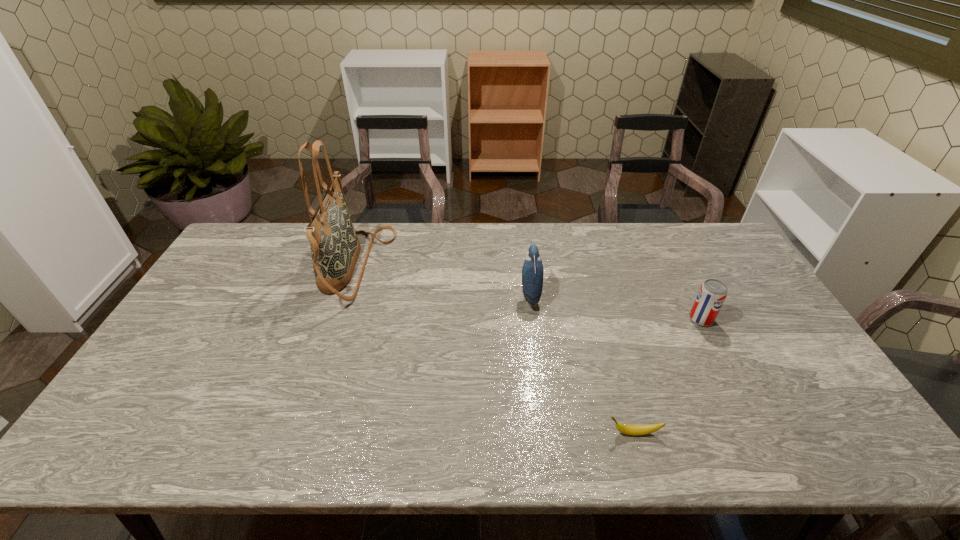
Find the location of a particular element. Image resolution: width=960 pixels, height=540 pixels. blank region between the soda and the bird is located at coordinates (615, 307).

Identify the location of the third closest object to the bird. (335, 248).

This screenshot has height=540, width=960. Find the location of `object identified as the closest to the leftmost object`. object identified as the closest to the leftmost object is located at coordinates (532, 270).

You are a GUI agent. You are given a task and a screenshot of the screen. Output one action in this format:
    pyautogui.click(x=<x>, y=<y>)
    Task: Click on the vacant point that satisfies the following two spatial constraints: 1. at the tip of the third shortest object's beak; 2. on the right side of the third tallest object
    The height and width of the screenshot is (540, 960).
    Given the screenshot: What is the action you would take?
    pyautogui.click(x=533, y=319)

This screenshot has width=960, height=540. Find the location of `vacant region that satisfies the following two spatial constraints: 1. on the back side of the second shortest object; 2. on the front-facing side of the tallest object`. vacant region that satisfies the following two spatial constraints: 1. on the back side of the second shortest object; 2. on the front-facing side of the tallest object is located at coordinates (674, 266).

Where is `free point that satisfies the following two spatial constraints: 1. at the tip of the bird's beak; 2. on the right side of the rightmost object`? free point that satisfies the following two spatial constraints: 1. at the tip of the bird's beak; 2. on the right side of the rightmost object is located at coordinates (533, 319).

Find the location of a particular element. This screenshot has width=960, height=540. free location that satisfies the following two spatial constraints: 1. at the tip of the third object from right to left's beak; 2. on the right side of the rightmost object is located at coordinates (533, 319).